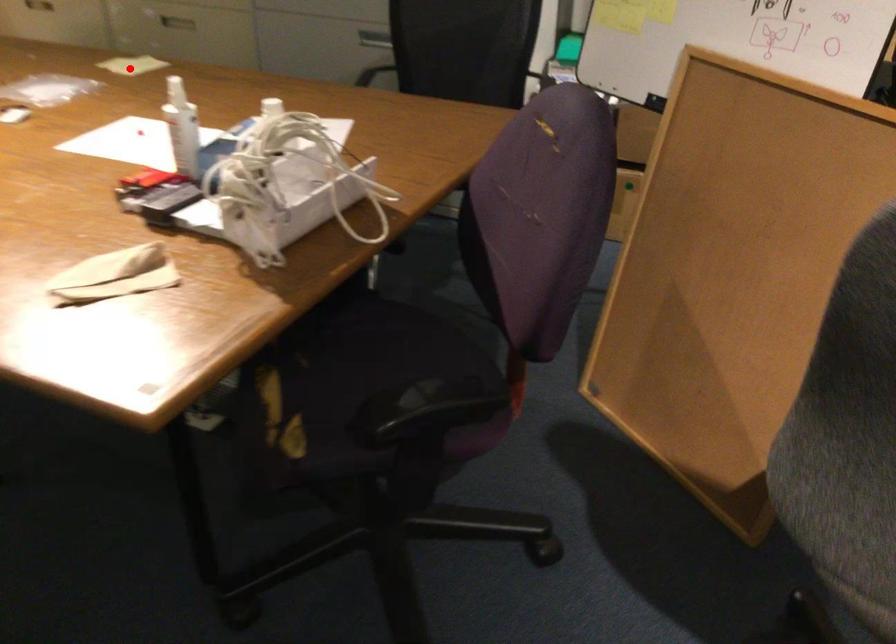
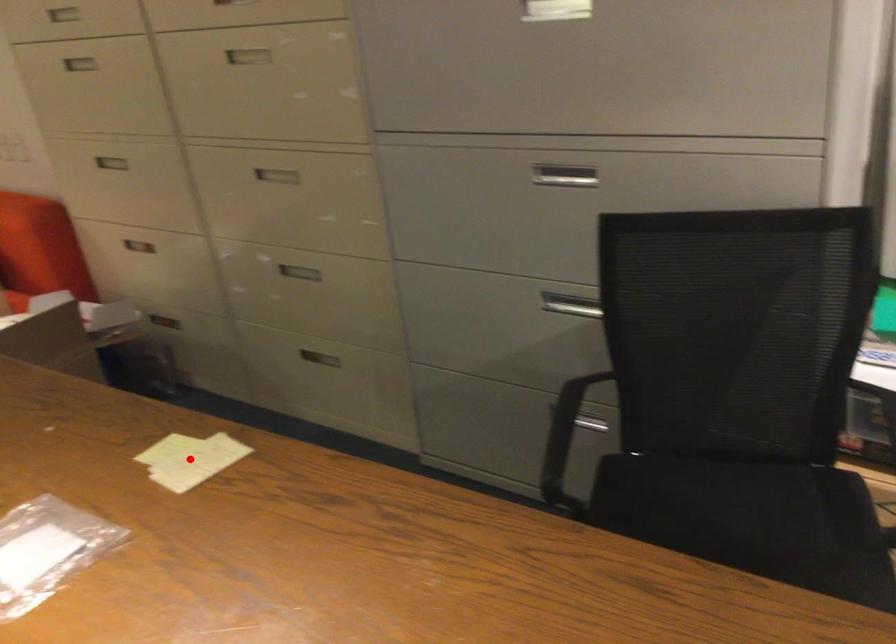
I am providing you with two images of the same scene from different viewpoints. A red point is marked on the first image and another point is marked on the second image. Do the highlighted points in image1 and image2 indicate the same real-world spot?

Yes